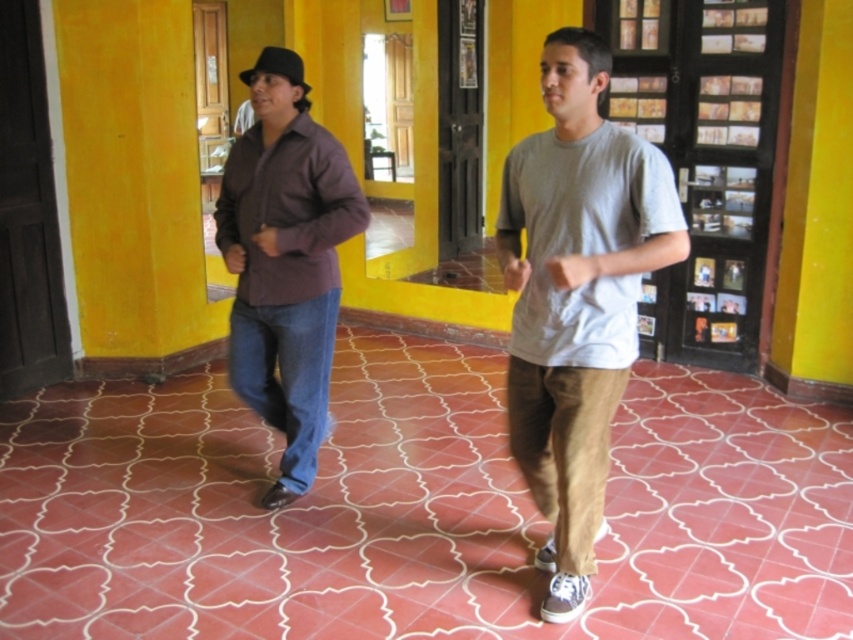
Question: Does gray cotton t-shirt at center have a lesser width compared to matte brown shirt at left?

Choices:
 (A) yes
 (B) no

Answer: (A)

Question: Does gray cotton t-shirt at center come behind matte black baseball hat at left?

Choices:
 (A) yes
 (B) no

Answer: (B)

Question: Which is farther from the matte black baseball hat at left?

Choices:
 (A) matte brown shirt at left
 (B) gray cotton t-shirt at center

Answer: (B)

Question: Which object appears farthest from the camera in this image?

Choices:
 (A) matte black baseball hat at left
 (B) matte brown shirt at left

Answer: (A)

Question: From the image, what is the correct spatial relationship of gray cotton t-shirt at center in relation to matte black baseball hat at left?

Choices:
 (A) left
 (B) right

Answer: (B)

Question: Among these points, which one is farthest from the camera?

Choices:
 (A) (242, 72)
 (B) (293, 157)
 (C) (518, 461)

Answer: (A)